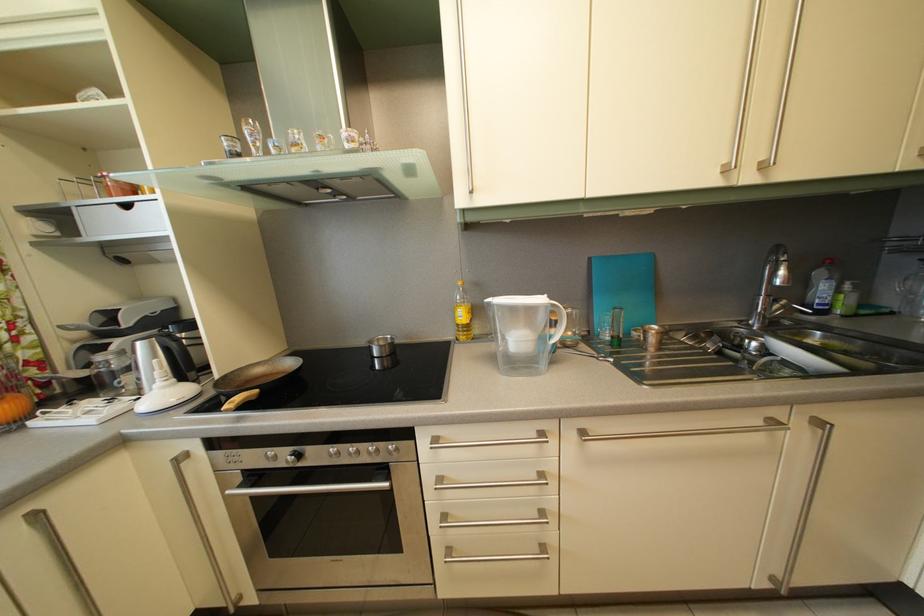
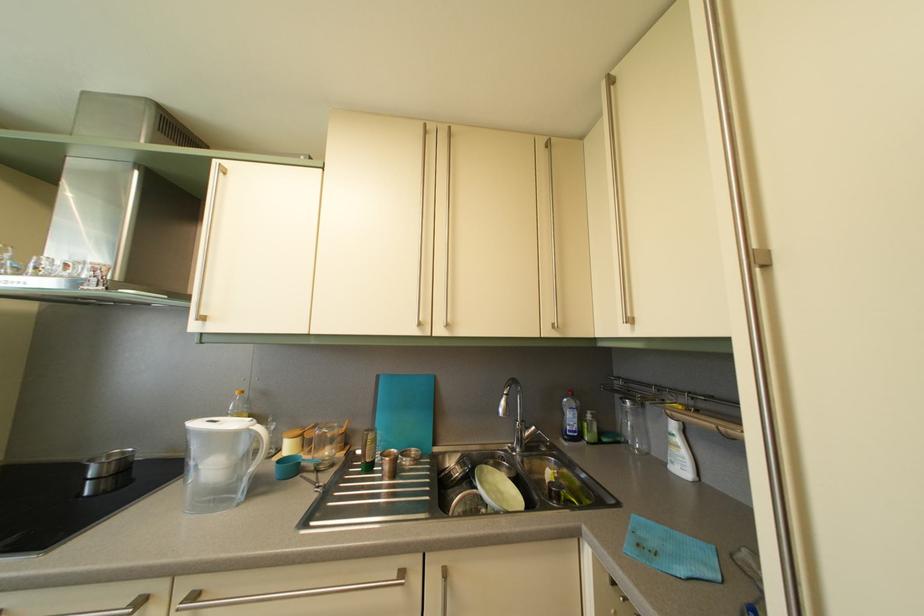
Locate, in the second image, the point that corresponds to (775,302) in the first image.

(530, 429)